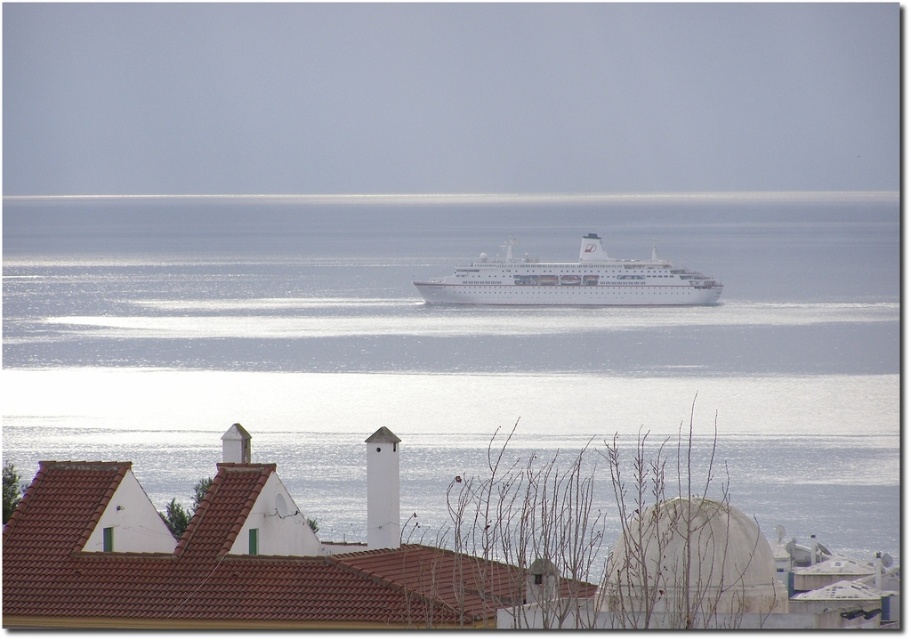
Question: Which of the following is the closest to the observer?

Choices:
 (A) (382, 307)
 (B) (548, 288)

Answer: (B)

Question: Is the position of blue water at center more distant than that of white glossy cruise ship at center?

Choices:
 (A) no
 (B) yes

Answer: (A)

Question: Among these points, which one is nearest to the camera?

Choices:
 (A) (244, 291)
 (B) (633, 291)

Answer: (B)

Question: Which of the following is the closest to the observer?

Choices:
 (A) blue water at center
 (B) white glossy cruise ship at center

Answer: (A)

Question: In this image, where is blue water at center located relative to white glossy cruise ship at center?

Choices:
 (A) right
 (B) left

Answer: (B)

Question: Does blue water at center appear on the right side of white glossy cruise ship at center?

Choices:
 (A) no
 (B) yes

Answer: (A)